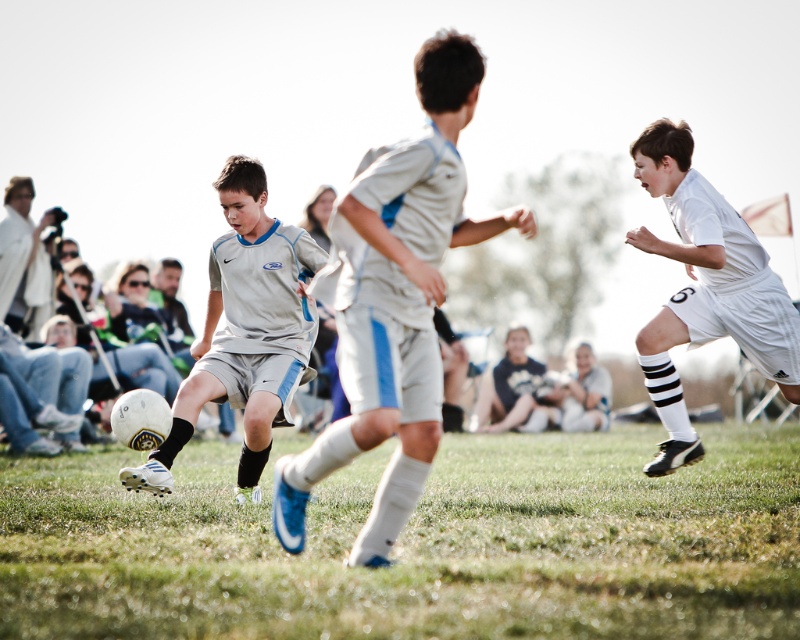
Which is below, white matte soccer uniform at right or white jersey at center?

Positioned lower is white jersey at center.

Does white matte soccer uniform at right appear on the right side of white jersey at center?

In fact, white matte soccer uniform at right is to the left of white jersey at center.

Between point (696, 236) and point (594, 358), which one is positioned in front?

Point (696, 236) is more forward.

Locate an element on the screen. The height and width of the screenshot is (640, 800). white matte soccer uniform at right is located at coordinates click(705, 289).

Is point (528, 413) positioned before point (598, 426)?

No, it is not.

Is point (504, 362) more distant than point (604, 396)?

Yes, it is behind point (604, 396).

At what (x,y) coordinates should I click in order to perform the action: click on dark blue jersey at center. Please return your answer as a coordinate pair (x, y). The height and width of the screenshot is (640, 800). Looking at the image, I should click on (512, 390).

Identify the location of dark blue jersey at center. (512, 390).

Between point (61, 630) and point (562, 412), which one is positioned in front?

Point (61, 630)

This screenshot has height=640, width=800. What do you see at coordinates (417, 545) in the screenshot?
I see `green grass at center` at bounding box center [417, 545].

Is point (28, 572) farther from camera compared to point (608, 387)?

No, it is not.

You are a GUI agent. You are given a task and a screenshot of the screen. Output one action in this format:
    pyautogui.click(x=<x>, y=<y>)
    Task: Click on the green grass at center
    Image resolution: width=800 pixels, height=640 pixels.
    Given the screenshot: What is the action you would take?
    pyautogui.click(x=417, y=545)